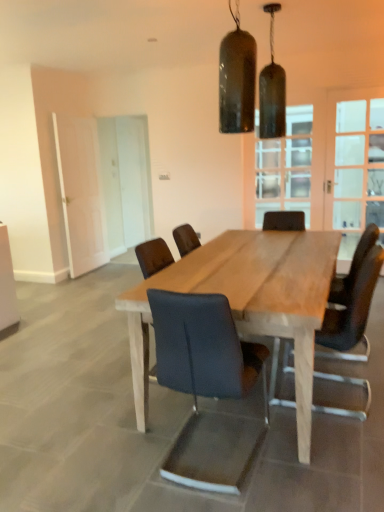
Question: Is white matte door at left, the 2th screen door from the right, taller or shorter than dark blue fabric chair at center, which appears as the 1th chair when viewed from the left?

Choices:
 (A) short
 (B) tall

Answer: (B)

Question: Choose the correct answer: Is white matte door at left, which is the first screen door from left to right, inside dark blue fabric chair at center, which appears as the 1th chair when viewed from the left, or outside it?

Choices:
 (A) outside
 (B) inside

Answer: (A)

Question: Considering the real-world distances, which object is farthest from the matte black chair at center, placed as the 2th chair when sorted from left to right?

Choices:
 (A) natural wood table at center
 (B) white matte door at left, which is the first screen door from left to right
 (C) matte glass pendant lights at upper center, which is counted as the first lamp, starting from the left
 (D) leather-like black chair at center, the first chair in the right-to-left sequence
 (E) matte black pendant light at upper center, which is the second lamp in front-to-back order

Answer: (B)

Question: Estimate the real-world distances between objects in this image. Which object is closer to the matte black chair at center, the second chair viewed from the right?

Choices:
 (A) white matte door at left, the 2th screen door from the right
 (B) dark blue fabric chair at center, which appears as the 1th chair when viewed from the left
 (C) clear glass door at right, the 1th glass door viewed from the right
 (D) natural wood table at center
 (E) clear glass window at upper center

Answer: (D)